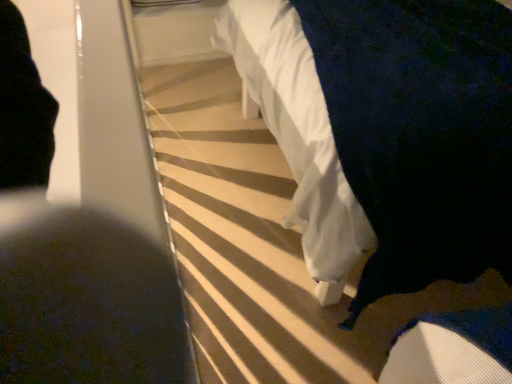
Question: Is dark fabric at lower left turned away from white fabric bed at upper center?

Choices:
 (A) no
 (B) yes

Answer: (A)

Question: Does dark fabric at lower left have a larger size compared to white fabric bed at upper center?

Choices:
 (A) yes
 (B) no

Answer: (A)

Question: From the image's perspective, is dark fabric at lower left on white fabric bed at upper center?

Choices:
 (A) no
 (B) yes

Answer: (B)

Question: Considering the relative positions of dark fabric at lower left and white fabric bed at upper center in the image provided, is dark fabric at lower left to the right of white fabric bed at upper center from the viewer's perspective?

Choices:
 (A) no
 (B) yes

Answer: (A)

Question: Is dark fabric at lower left oriented towards white fabric bed at upper center?

Choices:
 (A) no
 (B) yes

Answer: (A)

Question: Is dark fabric at lower left positioned beyond the bounds of white fabric bed at upper center?

Choices:
 (A) no
 (B) yes

Answer: (B)

Question: Can you confirm if white fabric bed at upper center is taller than dark fabric at lower left?

Choices:
 (A) no
 (B) yes

Answer: (A)

Question: Are white fabric bed at upper center and dark fabric at lower left located far from each other?

Choices:
 (A) no
 (B) yes

Answer: (B)

Question: Is the position of white fabric bed at upper center more distant than that of dark fabric at lower left?

Choices:
 (A) yes
 (B) no

Answer: (A)

Question: Is white fabric bed at upper center outside of dark fabric at lower left?

Choices:
 (A) yes
 (B) no

Answer: (A)

Question: From a real-world perspective, is white fabric bed at upper center beneath dark fabric at lower left?

Choices:
 (A) no
 (B) yes

Answer: (B)

Question: Considering the relative positions of white fabric bed at upper center and dark fabric at lower left in the image provided, is white fabric bed at upper center to the right of dark fabric at lower left from the viewer's perspective?

Choices:
 (A) yes
 (B) no

Answer: (A)

Question: From the image's perspective, is white fabric bed at upper center above or below dark fabric at lower left?

Choices:
 (A) above
 (B) below

Answer: (B)